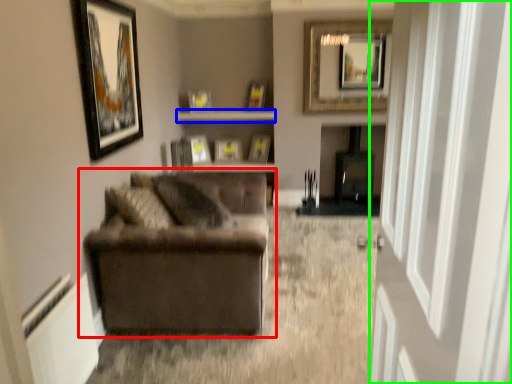
Question: Which object is positioned farthest from studio couch (highlighted by a red box)? Select from shelf (highlighted by a blue box) and glass door (highlighted by a green box).

Choices:
 (A) shelf
 (B) glass door

Answer: (A)